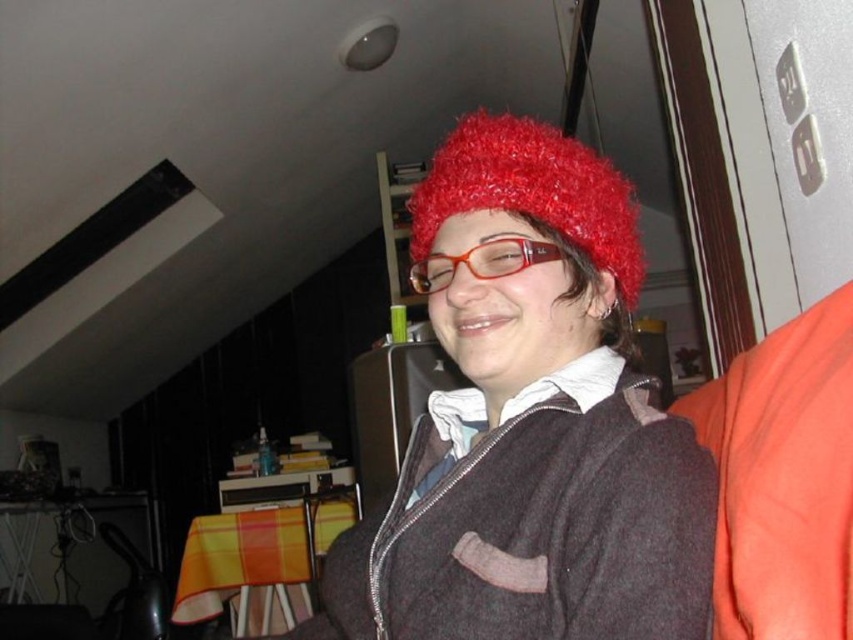
You are designing a display case that needs to accommodate both the fuzzy red hat at center and the fluffy red hat at upper center. What is the minimum required height of the display case to fit both hats vertically?

The minimum required height of the display case must be at least 5.44 inches to accommodate both the fuzzy red hat at center and the fluffy red hat at upper center vertically.

You are standing in the room and want to reach the point marked as point (442, 333). If your arm can extend 24 inches, can you reach it without moving?

The point (442, 333) is 25.96 inches from the viewer, which is slightly beyond your arm extension of 24 inches. Therefore, you cannot reach it without moving.

You are a fashion designer observing the scene and want to create a hat that matches the style of the fuzzy red hat at center and the fluffy red hat at upper center. Which hat should you base your design on if you want a larger version?

The fuzzy red hat at center has a larger size compared to the fluffy red hat at upper center, so you should base your design on the fuzzy red hat at center to create a larger version.